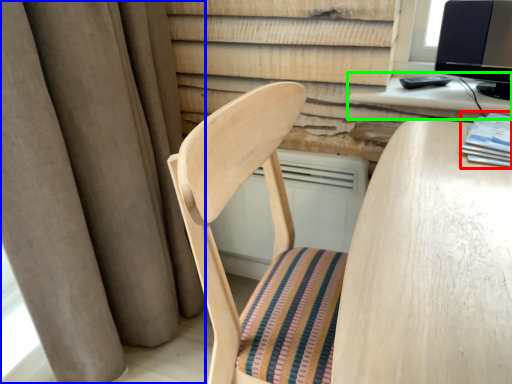
Question: Estimate the real-world distances between objects in this image. Which object is closer to book (highlighted by a red box), curtain (highlighted by a blue box) or computer desk (highlighted by a green box)?

Choices:
 (A) curtain
 (B) computer desk

Answer: (B)